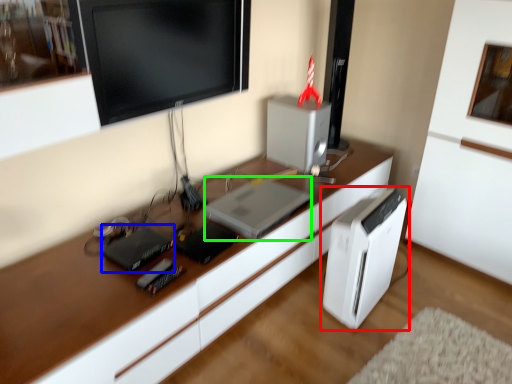
Question: Based on their relative distances, which object is nearer to home appliance (highlighted by a red box)? Choose from appliance (highlighted by a blue box) and computer (highlighted by a green box).

Choices:
 (A) appliance
 (B) computer

Answer: (B)